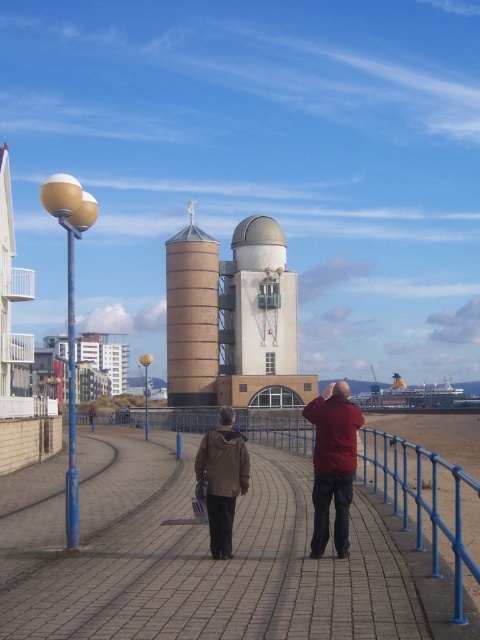
Is point (324, 413) closer to camera compared to point (223, 416)?

Yes.

Is matte red jacket at center thinner than brown matte jacket at center?

Yes, matte red jacket at center is thinner than brown matte jacket at center.

This screenshot has width=480, height=640. Find the location of `matte red jacket at center`. matte red jacket at center is located at coordinates pyautogui.click(x=333, y=464).

Between brown leather jacket at center and brown matte jacket at center, which one appears on the right side from the viewer's perspective?

From the viewer's perspective, brown leather jacket at center appears more on the right side.

Which of these two, brown leather jacket at center or brown matte jacket at center, stands taller?

brown matte jacket at center

Is point (227, 426) positioned before point (229, 406)?

Yes, point (227, 426) is in front of point (229, 406).

At what (x,y) coordinates should I click in order to perform the action: click on brown leather jacket at center. Please return your answer as a coordinate pair (x, y). This screenshot has height=640, width=480. Looking at the image, I should click on (333, 464).

Is brown brick tower at center closer to the viewer compared to brown leather jacket at center?

No, it is behind brown leather jacket at center.

Can you confirm if brown brick tower at center is positioned above brown leather jacket at center?

Indeed, brown brick tower at center is positioned over brown leather jacket at center.

Find the location of `brown brick tower at center`. brown brick tower at center is located at coordinates (192, 316).